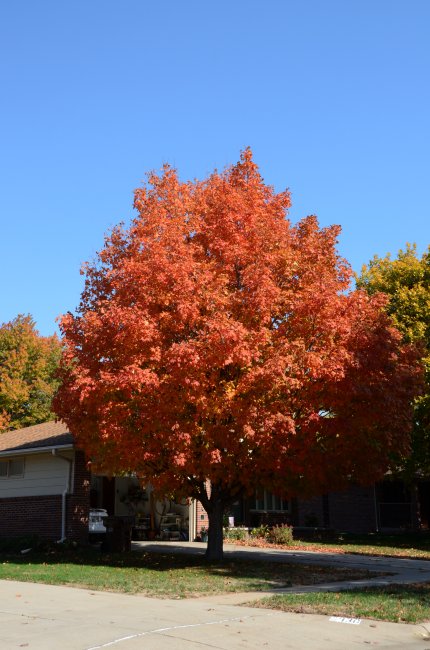
Find the location of a particular element. Image resolution: width=430 pixels, height=650 pixels. windows is located at coordinates (21, 470), (8, 470), (251, 496), (263, 498), (268, 500), (275, 500), (284, 499), (390, 512), (389, 495).